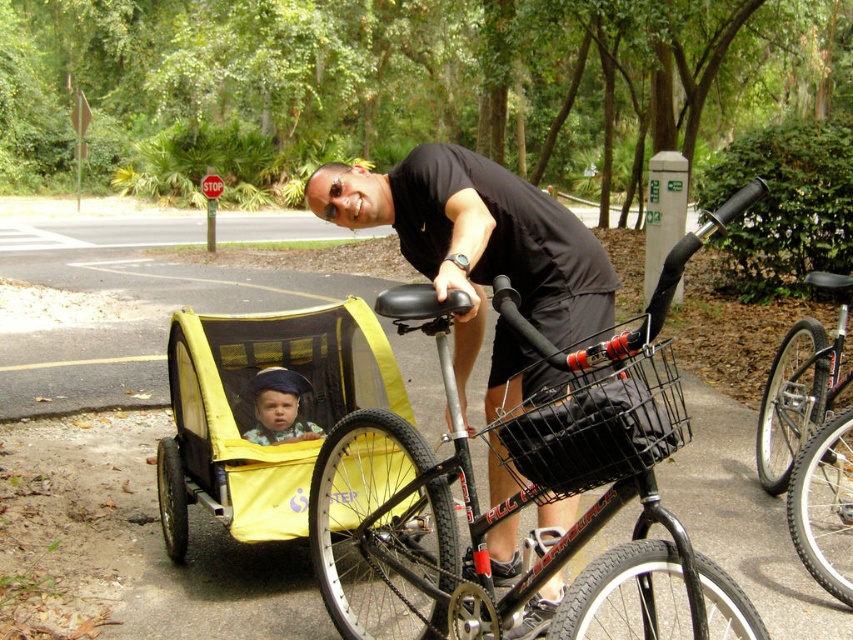
Is point (221, 449) farther from viewer compared to point (846, 310)?

No, (221, 449) is in front of (846, 310).

In the scene shown: Does yellow fabric baby carriage at center appear on the left side of black matte bicycle at right?

Correct, you'll find yellow fabric baby carriage at center to the left of black matte bicycle at right.

This screenshot has height=640, width=853. Describe the element at coordinates (253, 412) in the screenshot. I see `yellow fabric baby carriage at center` at that location.

You are a GUI agent. You are given a task and a screenshot of the screen. Output one action in this format:
    pyautogui.click(x=<x>, y=<y>)
    Task: Click on the yellow fabric baby carriage at center
    Image resolution: width=853 pixels, height=640 pixels.
    Given the screenshot: What is the action you would take?
    pyautogui.click(x=253, y=412)

I want to click on black matte shirt at center, so click(477, 241).

Is black matte shirt at center positioned behind yellow fabric baby carriage at center?

No, it is in front of yellow fabric baby carriage at center.

Locate an element on the screen. This screenshot has width=853, height=640. black matte shirt at center is located at coordinates (477, 241).

Can you confirm if black matte bicycle at right is positioned to the left of shiny silver wheel at lower right?

Incorrect, black matte bicycle at right is not on the left side of shiny silver wheel at lower right.

In the scene shown: Who is more distant from viewer, [821,388] or [813,444]?

Point [821,388]

What do you see at coordinates (799, 387) in the screenshot?
I see `black matte bicycle at right` at bounding box center [799, 387].

Identify the location of black matte bicycle at right. (799, 387).